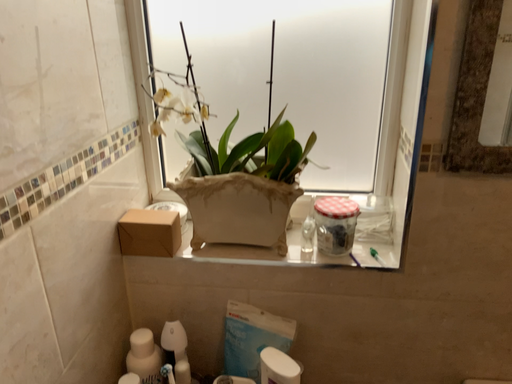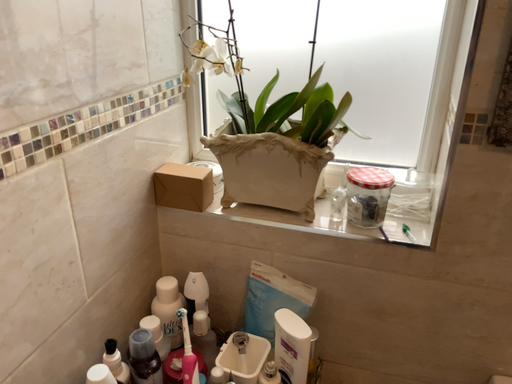
Question: Which way did the camera rotate in the video?

Choices:
 (A) rotated left
 (B) rotated right

Answer: (A)